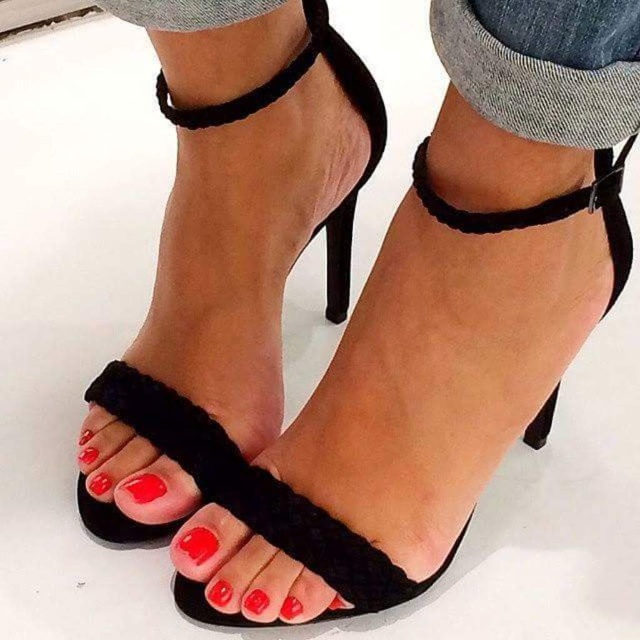
You are standing in front of the image and want to touch both points. Which point should you reach for first, point (168, 90) or point (184, 563)?

You should reach for point (168, 90) first because it is closer to you than point (184, 563).

You are a fashion designer trying to create a matching accessory. You have a velvet ribbon that is 3 cm wide. The velvet strap at center and the matte black toe at center are visible in the image. Which object can the ribbon fit under without overlapping?

The velvet ribbon that is 3 cm wide can fit under the velvet strap at center because it might be wider than the matte black toe at center, so the ribbon would fit better there.

Consider the image. You are a photographer setting up a shoot. You notice the velvet strap at center and the matte black toe at center in the scene. Which object is closer to the camera lens?

The velvet strap at center is closer to the camera lens because it is in front of the matte black toe at center.